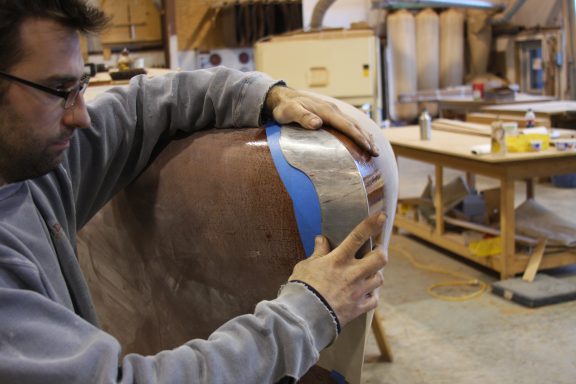
Locate an element on the screen. The width and height of the screenshot is (576, 384). yellow cable is located at coordinates (453, 280).